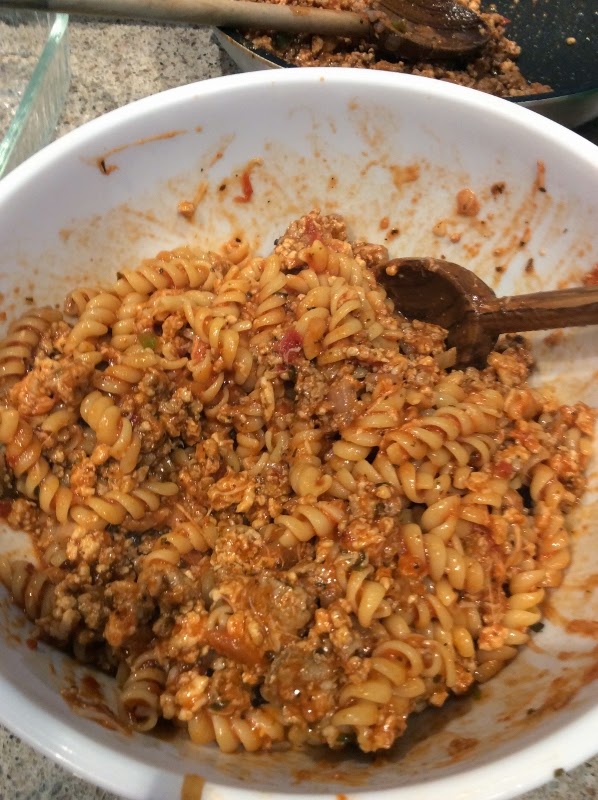
Find the location of a particular element. This screenshot has width=598, height=800. wooden spoon is located at coordinates (500, 316), (366, 22).